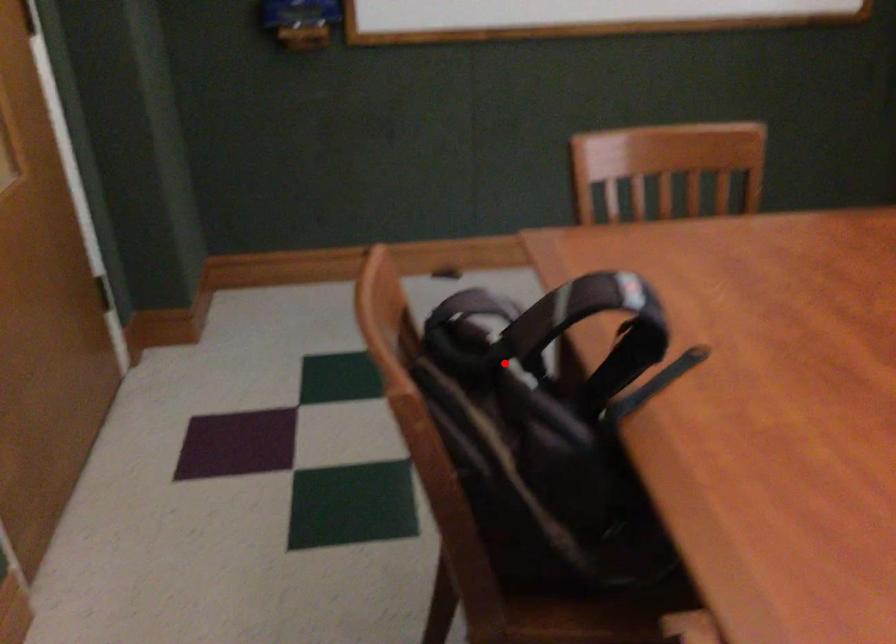
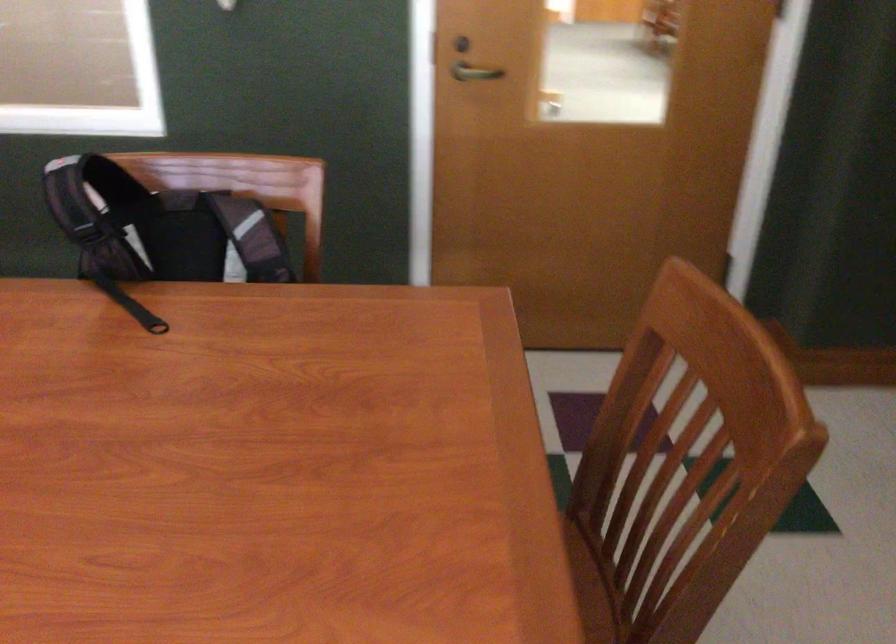
Question: I am providing you with two images of the same scene from different viewpoints. Image1 has a red point marked. In image2, the corresponding 3D location appears at what relative position? Reply with the corresponding letter.

Choices:
 (A) Closer
 (B) Farther

Answer: (B)